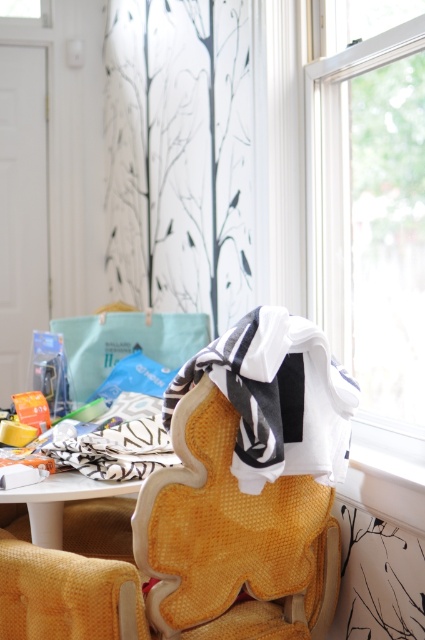
You are a delivery person entering the room and need to place a package on the table. The package is too large to carry around the chair. Can you place it directly on the white glossy table at center without moving the woven fabric armchair at lower left?

The woven fabric armchair at lower left is in front of the white glossy table at center, so the chair is blocking direct access to the table. You would need to move the chair to place the package directly on the white glossy table at center.

You are trying to decide whether to place a new floor lamp in this room. The lamp is 1.8 meters tall. Based on the scene, is there enough vertical space between the transparent glass window at upper right and the white cotton blanket at center to fit the lamp without it touching either?

The transparent glass window at upper right is much taller than the white cotton blanket at center, so there is sufficient vertical space between them to accommodate the 1.8 meter tall floor lamp without it touching either object.

You are standing in the living room and want to place a small plant on the table to the left of the woven fabric armchair at lower left. Is there enough space on the table for the plant?

The table to the left of the woven fabric armchair at lower left has items like a teal tote bag and colorful packaging, so there might not be enough space for the plant.